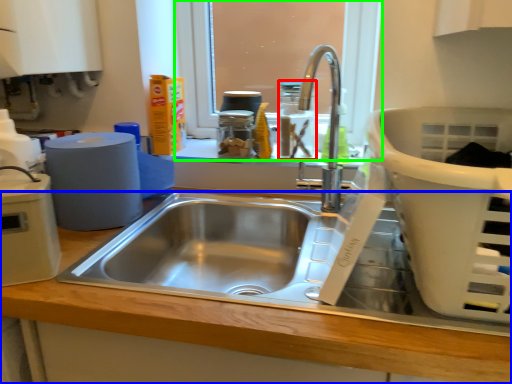
Question: Considering the real-world distances, which object is closest to bottle (highlighted by a red box)? counter top (highlighted by a blue box) or window screen (highlighted by a green box).

Choices:
 (A) counter top
 (B) window screen

Answer: (B)